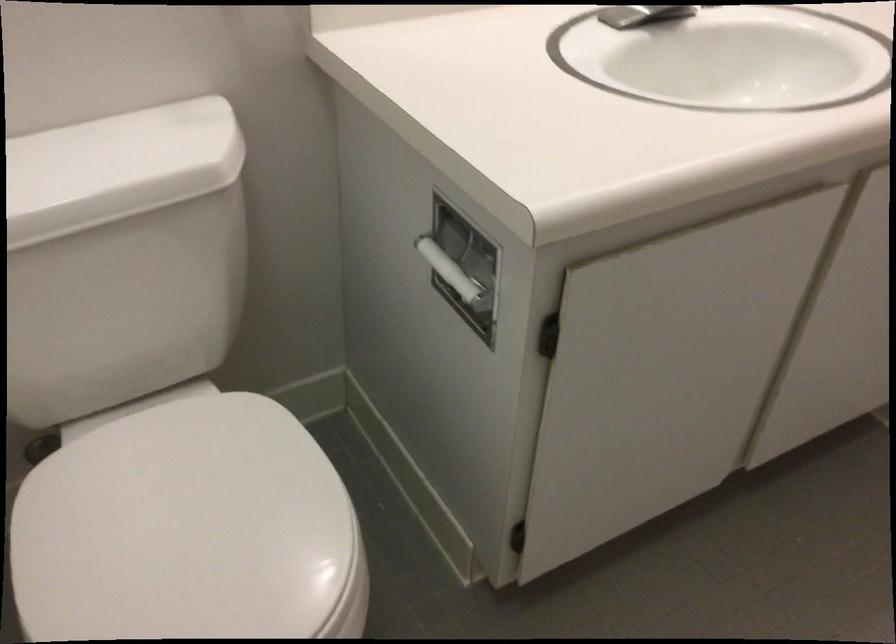
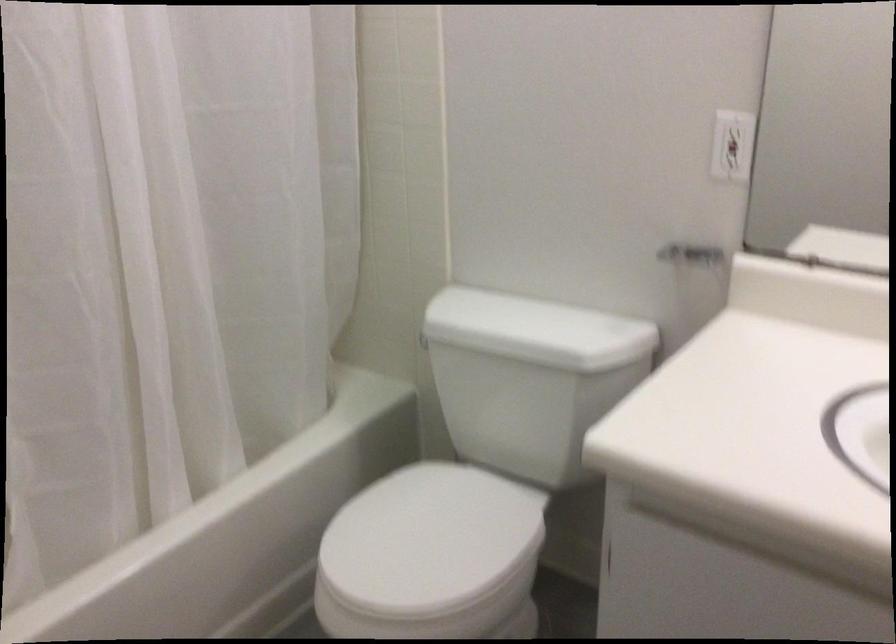
Question: The images are taken continuously from a first-person perspective. In which direction is your viewpoint rotating?

Choices:
 (A) Left
 (B) Right
 (C) Up
 (D) Down

Answer: (A)